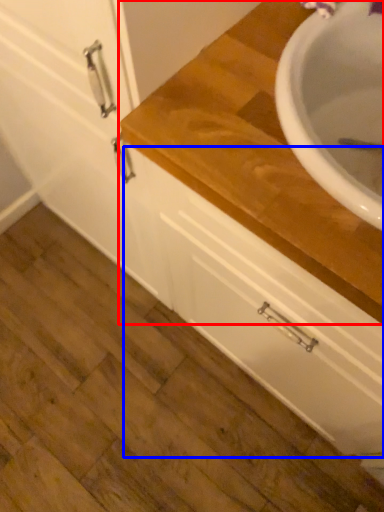
Question: Which object is further to the camera taking this photo, countertop (highlighted by a red box) or drawer (highlighted by a blue box)?

Choices:
 (A) countertop
 (B) drawer

Answer: (B)